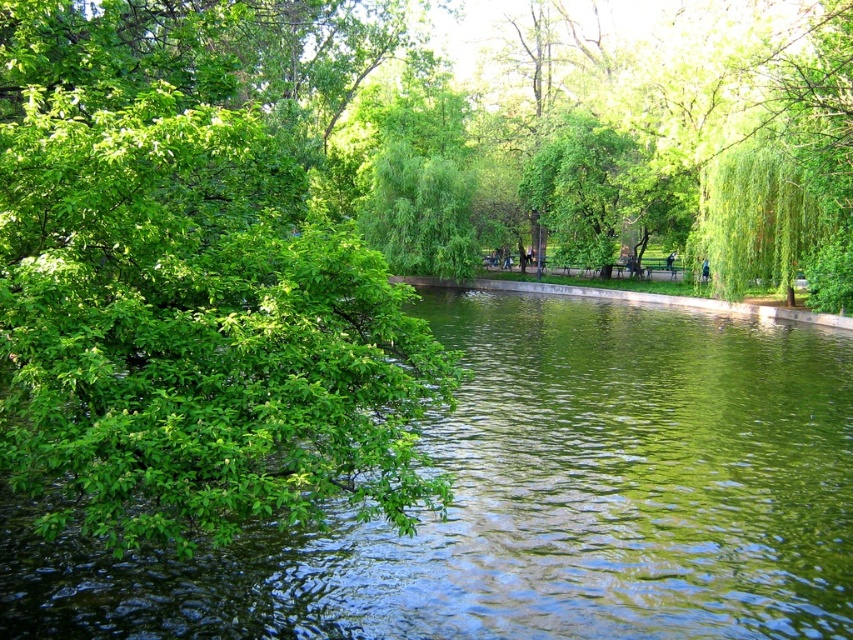
Between green leafy tree at left and green glossy water at center, which one is positioned lower?

green glossy water at center

Where is `green leafy tree at left`? green leafy tree at left is located at coordinates (192, 276).

Does point (65, 104) come behind point (619, 371)?

No.

Find the location of a particular element. This screenshot has height=640, width=853. green leafy tree at left is located at coordinates (192, 276).

The image size is (853, 640). What do you see at coordinates (192, 276) in the screenshot?
I see `green leafy tree at left` at bounding box center [192, 276].

Can you confirm if green leafy tree at left is thinner than green leafy tree at center?

In fact, green leafy tree at left might be wider than green leafy tree at center.

You are a GUI agent. You are given a task and a screenshot of the screen. Output one action in this format:
    pyautogui.click(x=<x>, y=<y>)
    Task: Click on the green leafy tree at left
    This screenshot has width=853, height=640.
    Given the screenshot: What is the action you would take?
    pyautogui.click(x=192, y=276)

Who is positioned more to the left, green leafy tree at left or green leafy tree at upper right?

green leafy tree at left

Does green leafy tree at left have a larger size compared to green leafy tree at upper right?

Yes.

Which is in front, point (196, 120) or point (840, 230)?

Point (196, 120) is in front.

Where is `green leafy tree at left`? Image resolution: width=853 pixels, height=640 pixels. green leafy tree at left is located at coordinates (192, 276).